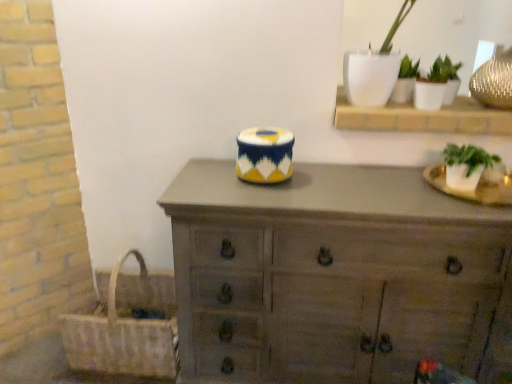
Question: Is woven straw picnic basket at lower left surrounding wooden chest of drawers at center?

Choices:
 (A) no
 (B) yes

Answer: (A)

Question: Is woven straw picnic basket at lower left positioned far away from wooden chest of drawers at center?

Choices:
 (A) yes
 (B) no

Answer: (B)

Question: Can you confirm if woven straw picnic basket at lower left is shorter than wooden chest of drawers at center?

Choices:
 (A) yes
 (B) no

Answer: (A)

Question: Is woven straw picnic basket at lower left taller than wooden chest of drawers at center?

Choices:
 (A) yes
 (B) no

Answer: (B)

Question: Considering the relative sizes of woven straw picnic basket at lower left and wooden chest of drawers at center in the image provided, is woven straw picnic basket at lower left thinner than wooden chest of drawers at center?

Choices:
 (A) no
 (B) yes

Answer: (B)

Question: From a real-world perspective, is white glossy pot at upper right, the 3th houseplant from the bottom, positioned above or below woven straw picnic basket at lower left?

Choices:
 (A) below
 (B) above

Answer: (B)

Question: Is white glossy pot at upper right, acting as the first houseplant starting from the top, to the left or to the right of woven straw picnic basket at lower left in the image?

Choices:
 (A) left
 (B) right

Answer: (B)

Question: Considering the positions of point (411, 64) and point (165, 286), is point (411, 64) closer or farther from the camera than point (165, 286)?

Choices:
 (A) closer
 (B) farther

Answer: (A)

Question: Is white glossy pot at upper right, the 3th houseplant from the bottom, in front of or behind woven straw picnic basket at lower left in the image?

Choices:
 (A) behind
 (B) front

Answer: (A)

Question: In the image, is white ceramic pot at upper right, which is the 2th houseplant in top-to-bottom order, positioned in front of or behind wooden shelf at upper right?

Choices:
 (A) behind
 (B) front

Answer: (A)

Question: Considering the positions of white ceramic pot at upper right, the second houseplant positioned from the bottom, and wooden shelf at upper right in the image, is white ceramic pot at upper right, the second houseplant positioned from the bottom, taller or shorter than wooden shelf at upper right?

Choices:
 (A) short
 (B) tall

Answer: (B)

Question: Looking at the image, does white ceramic pot at upper right, which is the 2th houseplant in top-to-bottom order, seem bigger or smaller compared to wooden shelf at upper right?

Choices:
 (A) big
 (B) small

Answer: (B)

Question: Considering the positions of point (453, 66) and point (457, 114), is point (453, 66) closer or farther from the camera than point (457, 114)?

Choices:
 (A) closer
 (B) farther

Answer: (B)

Question: In terms of size, does wooden chest of drawers at center appear bigger or smaller than wooden shelf at upper right?

Choices:
 (A) small
 (B) big

Answer: (B)

Question: In terms of width, does wooden chest of drawers at center look wider or thinner when compared to wooden shelf at upper right?

Choices:
 (A) wide
 (B) thin

Answer: (A)